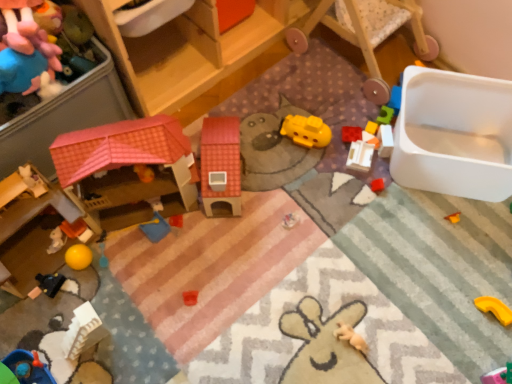
Question: Is black matte toy car at lower left, arranged as the 2th toy when viewed from the left, outside rubber brick at upper right, placed as the 7th toy when sorted from left to right?

Choices:
 (A) yes
 (B) no

Answer: (A)

Question: Considering the relative sizes of black matte toy car at lower left, the tenth toy viewed from the right, and rubber brick at upper right, which appears as the fifth toy when viewed from the right, in the image provided, is black matte toy car at lower left, the tenth toy viewed from the right, thinner than rubber brick at upper right, which appears as the fifth toy when viewed from the right,?

Choices:
 (A) no
 (B) yes

Answer: (A)

Question: From the image's perspective, is black matte toy car at lower left, the tenth toy viewed from the right, over rubber brick at upper right, placed as the 7th toy when sorted from left to right?

Choices:
 (A) no
 (B) yes

Answer: (A)

Question: Does black matte toy car at lower left, arranged as the 2th toy when viewed from the left, appear on the right side of rubber brick at upper right, placed as the 7th toy when sorted from left to right?

Choices:
 (A) yes
 (B) no

Answer: (B)

Question: Is black matte toy car at lower left, the tenth toy viewed from the right, next to rubber brick at upper right, placed as the 7th toy when sorted from left to right, and touching it?

Choices:
 (A) yes
 (B) no

Answer: (B)

Question: Is black matte toy car at lower left, arranged as the 2th toy when viewed from the left, positioned with its back to rubber brick at upper right, placed as the 7th toy when sorted from left to right?

Choices:
 (A) no
 (B) yes

Answer: (A)

Question: Is light brown plush toy at lower right, the sixth toy from the right, not inside black matte toy car at lower left, arranged as the 2th toy when viewed from the left?

Choices:
 (A) no
 (B) yes

Answer: (B)

Question: Is the depth of light brown plush toy at lower right, the sixth toy from the right, less than that of black matte toy car at lower left, arranged as the 2th toy when viewed from the left?

Choices:
 (A) no
 (B) yes

Answer: (B)

Question: Is light brown plush toy at lower right, the sixth toy from the right, at the right side of black matte toy car at lower left, the tenth toy viewed from the right?

Choices:
 (A) yes
 (B) no

Answer: (A)

Question: Does light brown plush toy at lower right, which appears as the 6th toy when viewed from the left, lie behind black matte toy car at lower left, the tenth toy viewed from the right?

Choices:
 (A) no
 (B) yes

Answer: (A)

Question: Would you say light brown plush toy at lower right, which appears as the 6th toy when viewed from the left, contains black matte toy car at lower left, the tenth toy viewed from the right?

Choices:
 (A) yes
 (B) no

Answer: (B)

Question: From a real-world perspective, is light brown plush toy at lower right, which appears as the 6th toy when viewed from the left, physically above black matte toy car at lower left, the tenth toy viewed from the right?

Choices:
 (A) no
 (B) yes

Answer: (A)

Question: Are rubber brick at upper right, which appears as the fifth toy when viewed from the right, and yellow matte submarine at center, which is the 5th toy in left-to-right order, making contact?

Choices:
 (A) yes
 (B) no

Answer: (B)